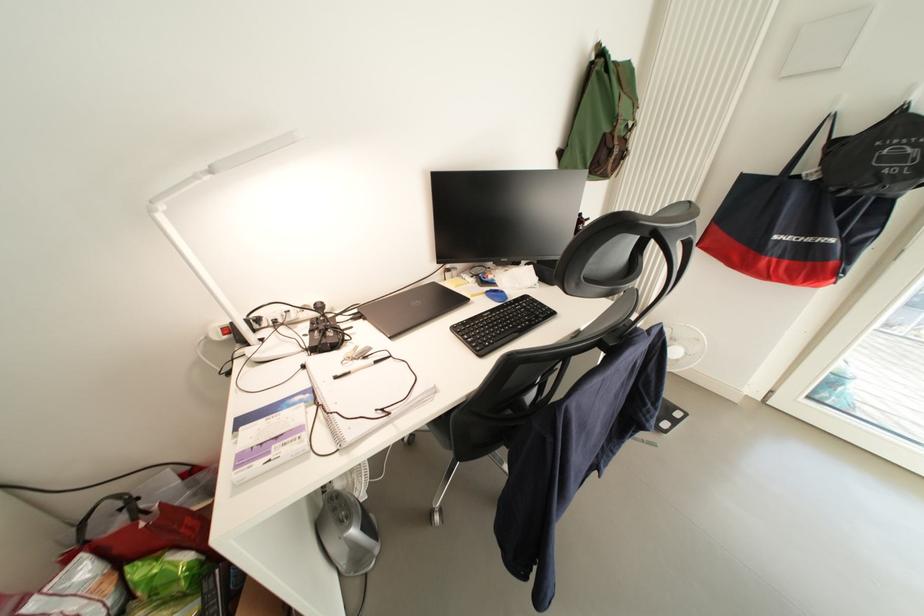
Identify the location of white lamp arm. The image size is (924, 616). (223, 167).